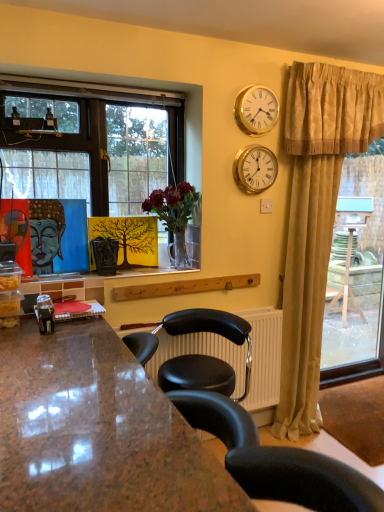
Question: Can you confirm if gold metallic clock at upper right, which is the 2th clock from top to bottom, is smaller than clear glass vase at center?

Choices:
 (A) no
 (B) yes

Answer: (B)

Question: Can you confirm if gold metallic clock at upper right, which appears as the first clock when ordered from the bottom, is thinner than clear glass vase at center?

Choices:
 (A) no
 (B) yes

Answer: (B)

Question: Is the depth of gold metallic clock at upper right, which is the 2th clock from top to bottom, less than that of clear glass vase at center?

Choices:
 (A) yes
 (B) no

Answer: (B)

Question: From a real-world perspective, is gold metallic clock at upper right, which appears as the first clock when ordered from the bottom, positioned under clear glass vase at center based on gravity?

Choices:
 (A) yes
 (B) no

Answer: (B)

Question: Is gold metallic clock at upper right, which is the 2th clock from top to bottom, not inside clear glass vase at center?

Choices:
 (A) no
 (B) yes

Answer: (B)

Question: From the image's perspective, is gold metallic clock at upper right, which appears as the first clock when ordered from the bottom, located above clear glass vase at center?

Choices:
 (A) yes
 (B) no

Answer: (A)

Question: Does clear glass vase at center have a larger size compared to matte blue buddha at left?

Choices:
 (A) yes
 (B) no

Answer: (A)

Question: Is clear glass vase at center closer to camera compared to matte blue buddha at left?

Choices:
 (A) yes
 (B) no

Answer: (A)

Question: Is clear glass vase at center oriented away from matte blue buddha at left?

Choices:
 (A) no
 (B) yes

Answer: (A)

Question: Can you confirm if clear glass vase at center is smaller than matte blue buddha at left?

Choices:
 (A) yes
 (B) no

Answer: (B)

Question: From the image's perspective, is clear glass vase at center over matte blue buddha at left?

Choices:
 (A) no
 (B) yes

Answer: (B)

Question: Is clear glass vase at center aimed at matte blue buddha at left?

Choices:
 (A) no
 (B) yes

Answer: (A)

Question: Is matte blue buddha at left positioned with its back to gold metallic clock at upper right, acting as the 1th clock starting from the top?

Choices:
 (A) yes
 (B) no

Answer: (B)